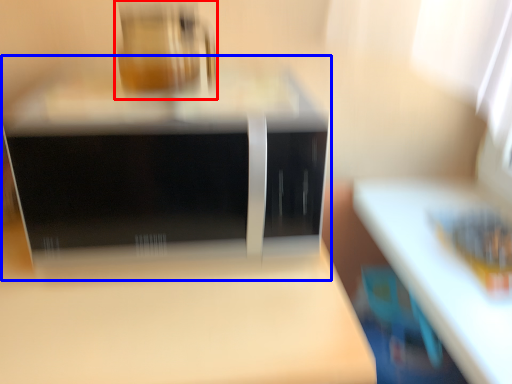
Question: Which object appears closest to the camera in this image, appliance (highlighted by a red box) or home appliance (highlighted by a blue box)?

Choices:
 (A) appliance
 (B) home appliance

Answer: (B)